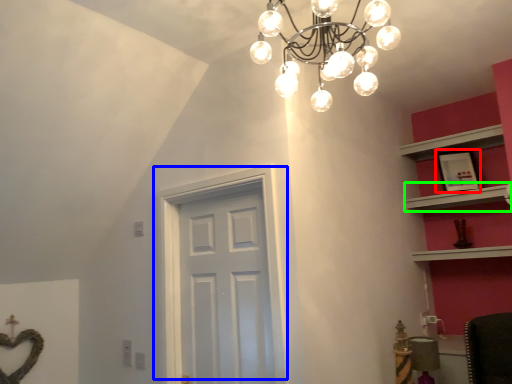
Question: Based on their relative distances, which object is nearer to picture frame (highlighted by a red box)? Choose from door (highlighted by a blue box) and shelf (highlighted by a green box).

Choices:
 (A) door
 (B) shelf

Answer: (B)